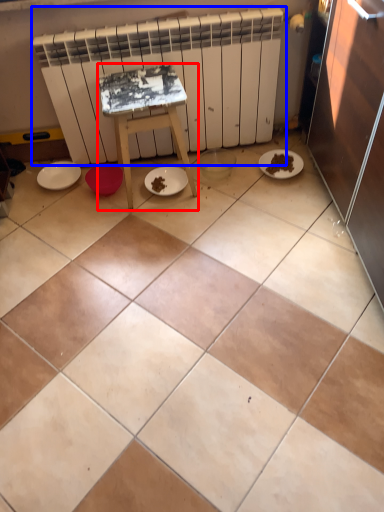
Question: Which object is further to the camera taking this photo, furniture (highlighted by a red box) or radiator (highlighted by a blue box)?

Choices:
 (A) furniture
 (B) radiator

Answer: (B)